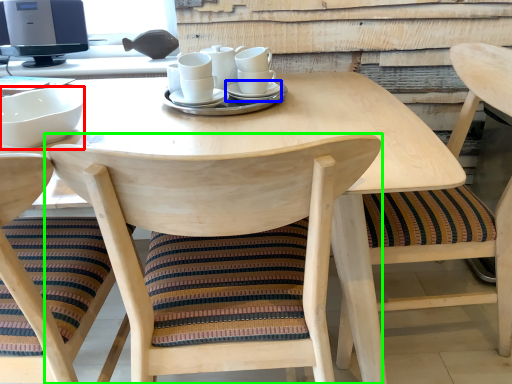
Question: Which is farther away from bowl (highlighted by a red box)? saucer (highlighted by a blue box) or chair (highlighted by a green box)?

Choices:
 (A) saucer
 (B) chair

Answer: (A)